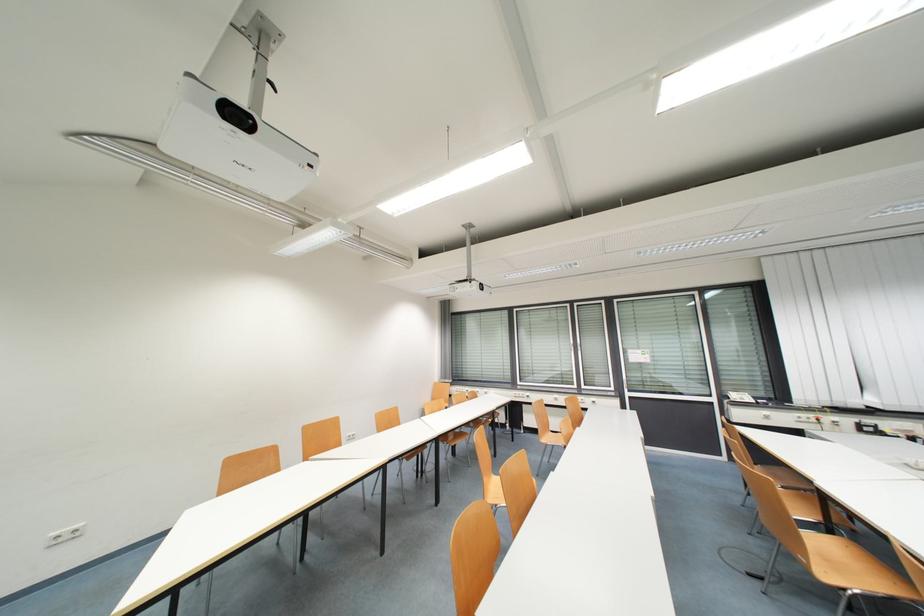
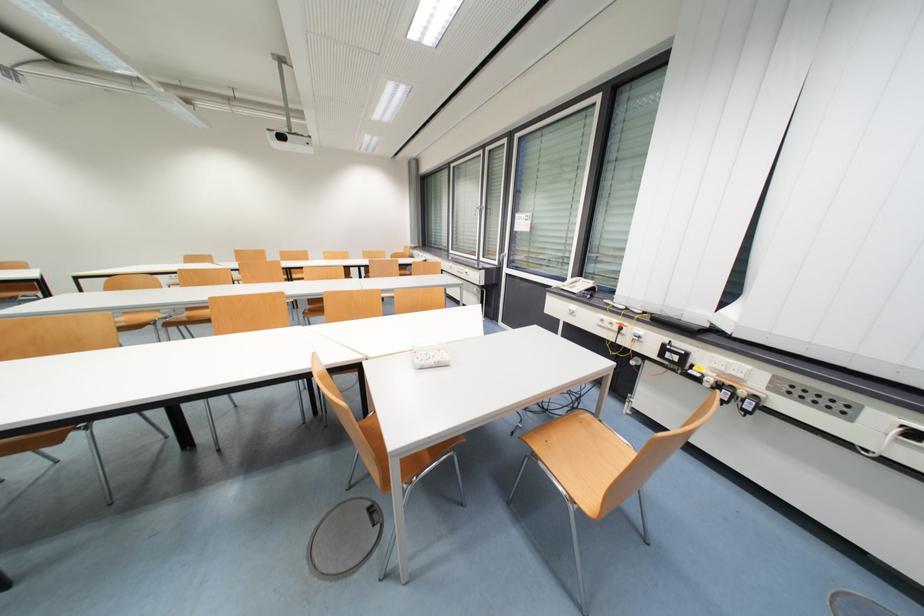
In the second image, find the point that corresponds to the point at 865,427 in the first image.

(671, 350)